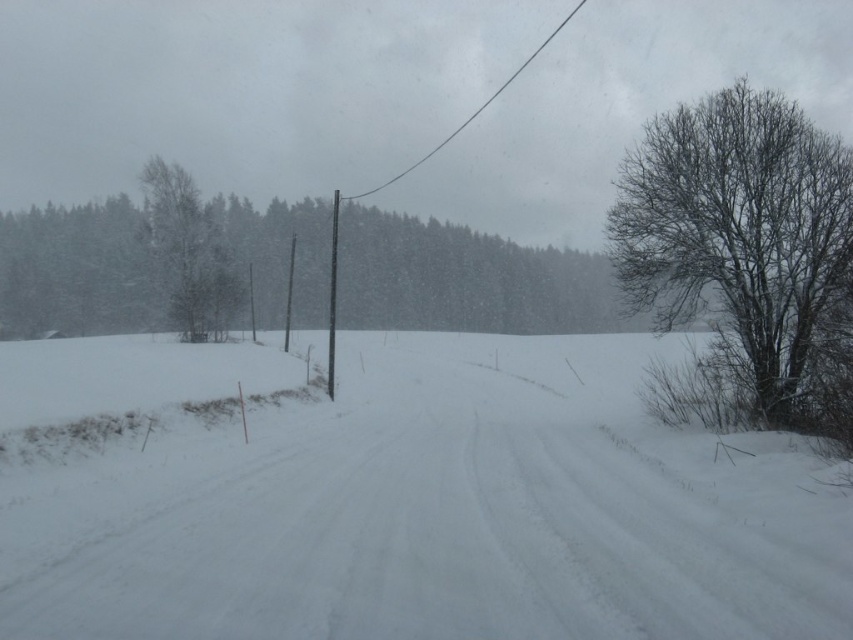
You are planning to place a decorative snowman on the white powdery snow at center. The base of the snowman requires a platform that must be wider than the black wire at upper center. Can the snow at center accommodate the platform?

The white powdery snow at center has a width less than the black wire at upper center, so it cannot accommodate a platform wider than the black wire at upper center.

You are an observer looking at the snowy landscape. You notice the green textured tree at left and the black wire at upper center. Which object is positioned to the left of the other?

The green textured tree at left is positioned to the left of the black wire at upper center.

You are a photographer positioned at the center of the snowy landscape. You want to capture a photo that includes both the tire tracks running through the center and the bare branches at right. Based on their positions, where should you aim your camera to ensure both elements are in the frame?

To include both the tire tracks running through the center and the bare branches at right in your photo, aim your camera towards the right side of the frame, as the bare branches at right are located at point [746,244] in the image, which is to the right of the center. This positioning will ensure both elements are captured within the frame.